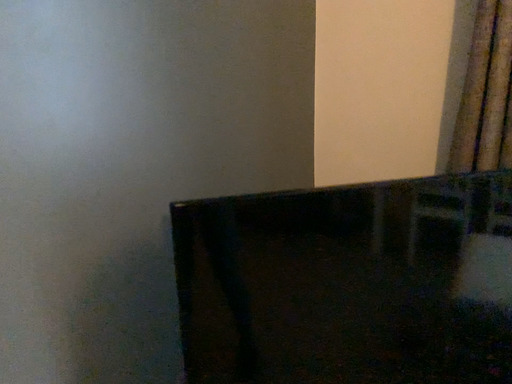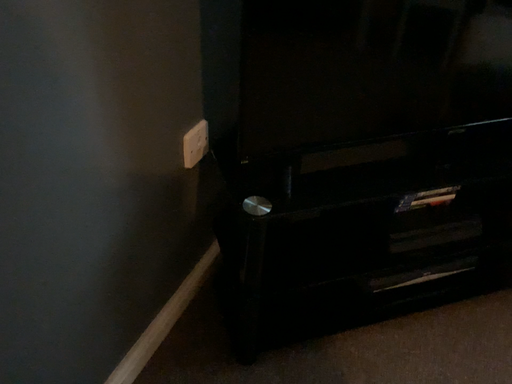
Question: How did the camera likely rotate when shooting the video?

Choices:
 (A) rotated downward
 (B) rotated upward

Answer: (A)